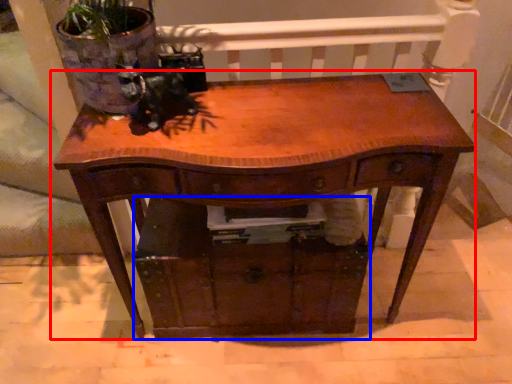
Question: Which object appears closest to the camera in this image, table (highlighted by a red box) or drawer (highlighted by a blue box)?

Choices:
 (A) table
 (B) drawer

Answer: (A)